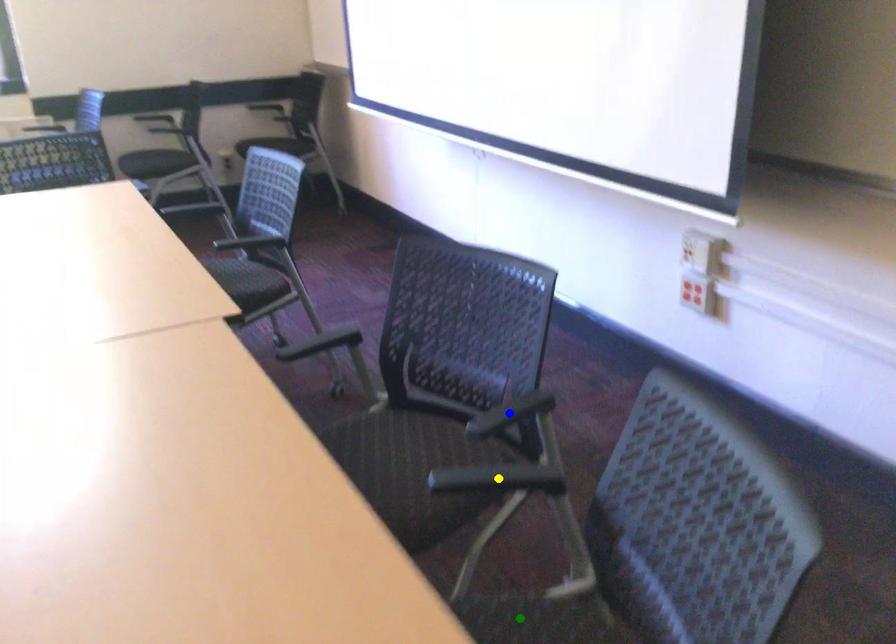
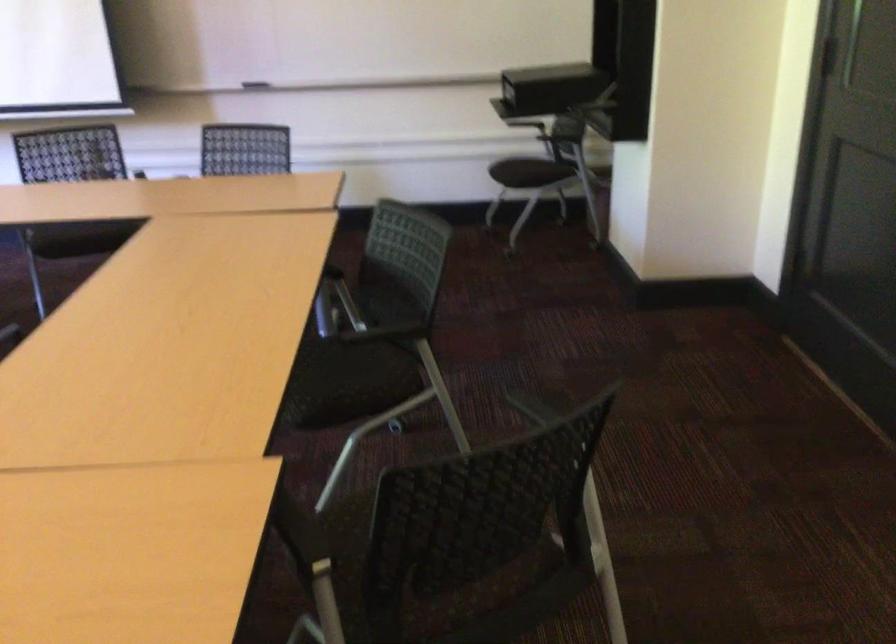
I am providing you with two images of the same scene from different viewpoints. Three points are marked in image1. Which point corresponds to a part or object that is occluded in image2?In image1, three points are marked. Which of them correspond to a part or object that is occluded in image2?Among the three points shown in image1, which one corresponds to a part or object that is no longer visible due to occlusion in image2?

green point, blue point, yellow point cannot be seen in image2.